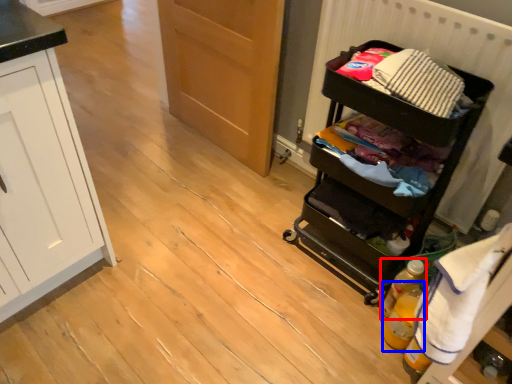
Question: Which object appears farthest to the camera in this image, bottle (highlighted by a red box) or bottle (highlighted by a blue box)?

Choices:
 (A) bottle
 (B) bottle

Answer: (A)